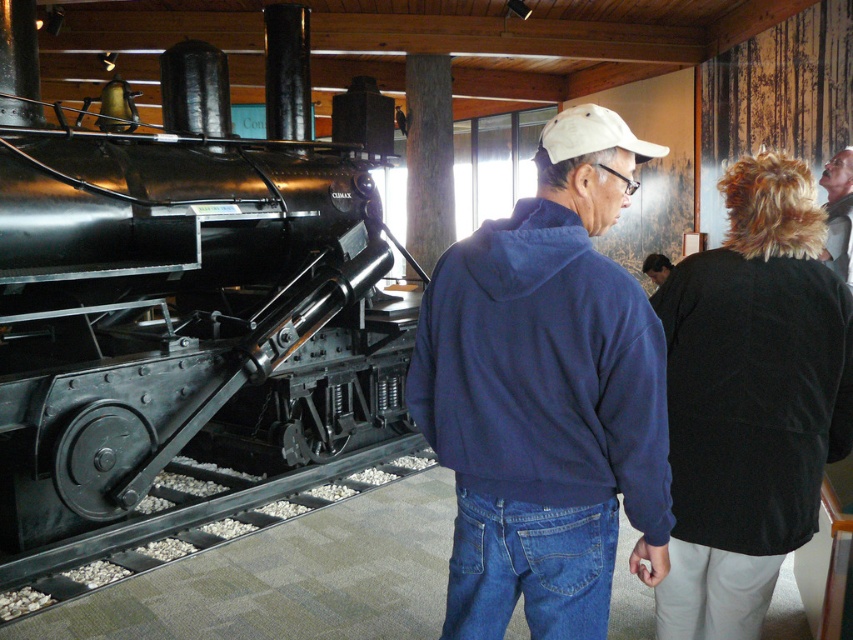
Is black metal train track at lower left below matte black shirt at center?

Yes, black metal train track at lower left is below matte black shirt at center.

Between point (410, 474) and point (654, 253), which one is positioned in front?

Point (410, 474) is more forward.

Which is in front, point (91, 570) or point (643, 264)?

Positioned in front is point (91, 570).

What are the coordinates of `black metal train track at lower left` in the screenshot? It's located at (215, 528).

Is blue fleece jacket at center positioned in front of matte black shirt at center?

Yes, it is in front of matte black shirt at center.

Based on the photo, is blue fleece jacket at center shorter than matte black shirt at center?

In fact, blue fleece jacket at center may be taller than matte black shirt at center.

Which is behind, point (610, 312) or point (664, 272)?

Positioned behind is point (664, 272).

Locate an element on the screen. The height and width of the screenshot is (640, 853). blue fleece jacket at center is located at coordinates (546, 396).

Who is shorter, polished black locomotive at left or white fabric baseball cap at upper center?

Standing shorter between the two is white fabric baseball cap at upper center.

Consider the image. Is polished black locomotive at left thinner than white fabric baseball cap at upper center?

Incorrect, polished black locomotive at left's width is not less than white fabric baseball cap at upper center's.

Where is `polished black locomotive at left`? polished black locomotive at left is located at coordinates (178, 282).

The height and width of the screenshot is (640, 853). Identify the location of polished black locomotive at left. (178, 282).